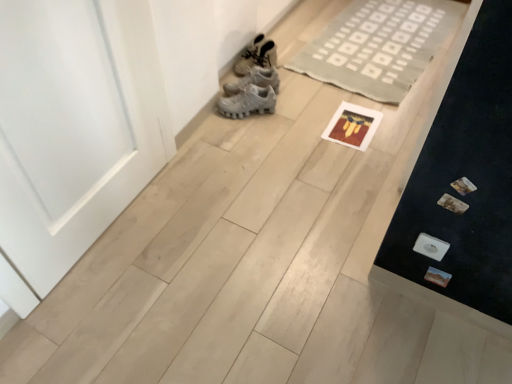
Where is `vacant region in front of white matte door at left`? vacant region in front of white matte door at left is located at coordinates (117, 307).